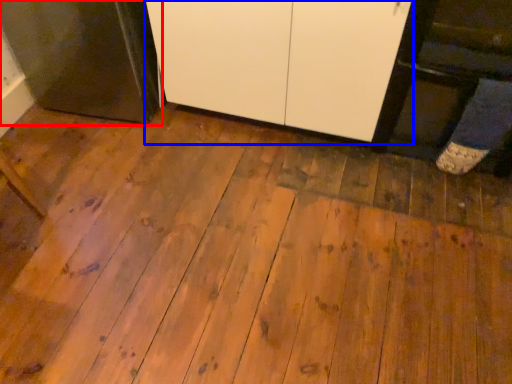
Question: Which of the following is the closest to the observer, appliance (highlighted by a red box) or cabinetry (highlighted by a blue box)?

Choices:
 (A) appliance
 (B) cabinetry

Answer: (B)